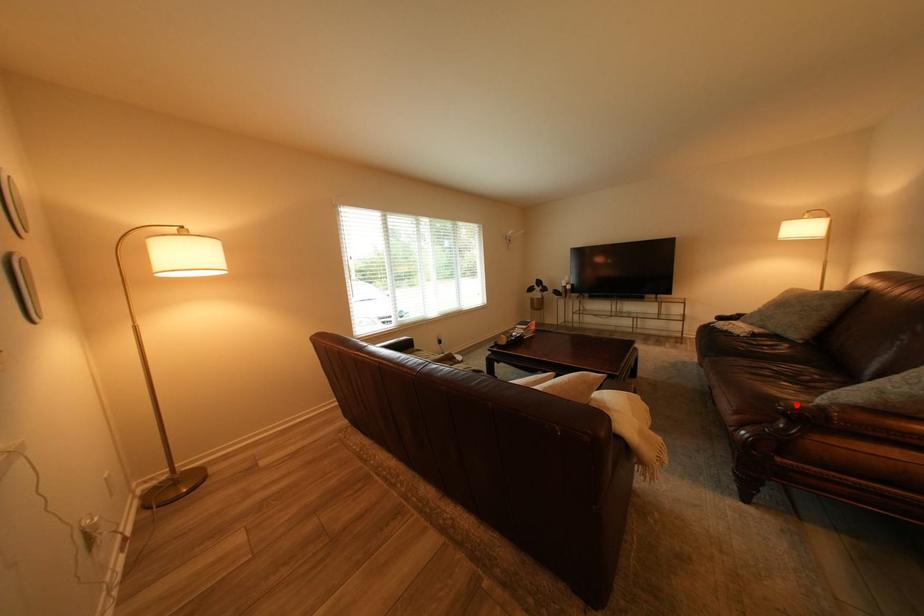
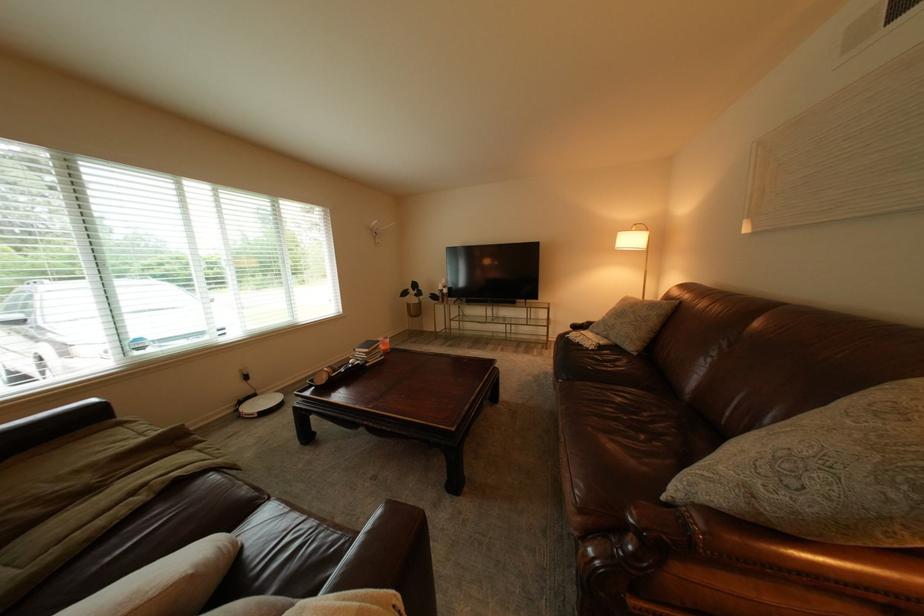
The point at the highlighted location is marked in the first image. Where is the corresponding point in the second image?

(648, 513)